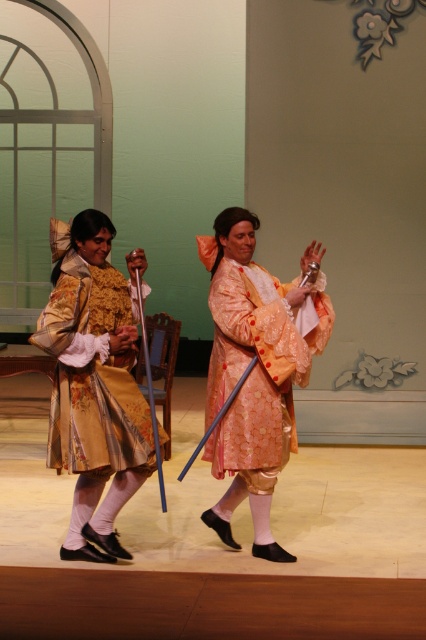
Is gold brocade dress at center to the left of matte peach robe at center from the viewer's perspective?

Indeed, gold brocade dress at center is positioned on the left side of matte peach robe at center.

Which is behind, point (106, 368) or point (239, 339)?

Positioned behind is point (239, 339).

I want to click on gold brocade dress at center, so click(x=94, y=385).